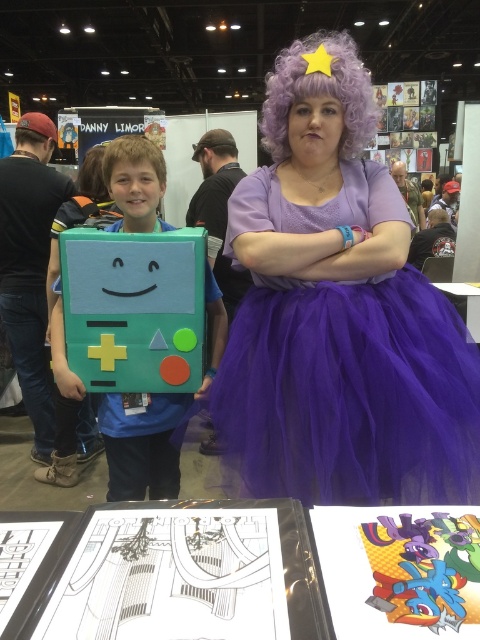
Which is behind, point (275, 241) or point (399, 596)?

The point (275, 241) is behind.

Who is more forward, (x=343, y=435) or (x=443, y=627)?

Positioned in front is point (x=443, y=627).

The height and width of the screenshot is (640, 480). Find the location of `purple tulle dress at center`. purple tulle dress at center is located at coordinates (338, 314).

Which is more to the right, purple tulle dress at center or matte cardboard box at left?

purple tulle dress at center

Can you confirm if purple tulle dress at center is taller than matte cardboard box at left?

Indeed, purple tulle dress at center has a greater height compared to matte cardboard box at left.

Image resolution: width=480 pixels, height=640 pixels. What do you see at coordinates (338, 314) in the screenshot?
I see `purple tulle dress at center` at bounding box center [338, 314].

The width and height of the screenshot is (480, 640). Identify the location of purple tulle dress at center. (338, 314).

Is matte cardboard box at left to the right of multicolored paper art at center from the viewer's perspective?

No, matte cardboard box at left is not to the right of multicolored paper art at center.

Between matte cardboard box at left and multicolored paper art at center, which one appears on the right side from the viewer's perspective?

From the viewer's perspective, multicolored paper art at center appears more on the right side.

What do you see at coordinates (155, 422) in the screenshot? The image size is (480, 640). I see `matte cardboard box at left` at bounding box center [155, 422].

This screenshot has height=640, width=480. Identify the location of matte cardboard box at left. (155, 422).